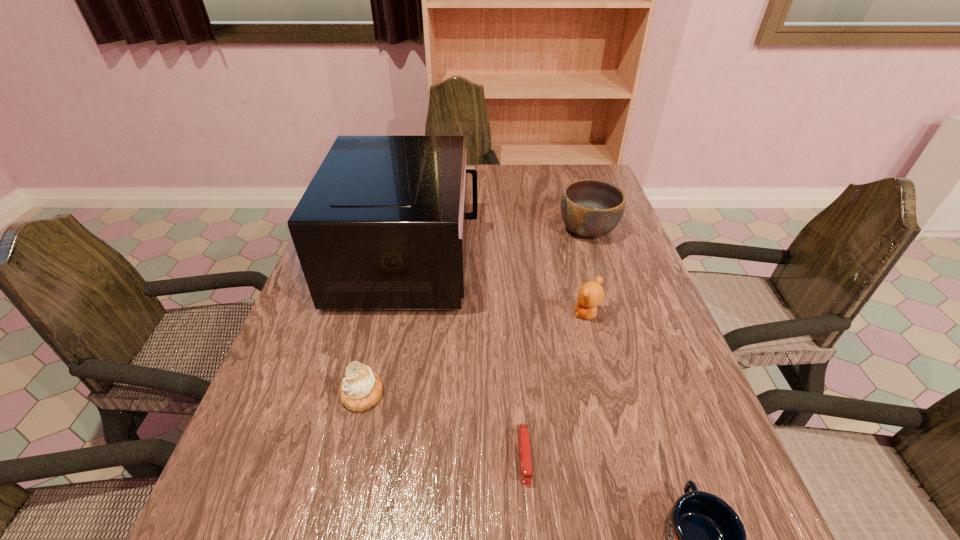
Image resolution: width=960 pixels, height=540 pixels. Identify the location of vacant space that is in between the pastry and the bowl. (475, 312).

Identify the location of unoccupied area between the tallest object and the bowl. This screenshot has width=960, height=540. (498, 244).

Where is `vacant area between the stapler and the third tallest object`? vacant area between the stapler and the third tallest object is located at coordinates (556, 386).

Image resolution: width=960 pixels, height=540 pixels. Identify the location of free point between the third object from left to right and the pastry. (444, 425).

In order to click on unoccupied position between the pastry and the stapler in this screenshot , I will do `click(444, 425)`.

Identify which object is located as the second nearest to the tallest object. Please provide its 2D coordinates. Your answer should be formatted as a tuple, i.e. [(x, y)], where the tuple contains the x and y coordinates of a point satisfying the conditions above.

[(591, 294)]

The image size is (960, 540). I want to click on object that is the third closest to the stapler, so click(x=591, y=294).